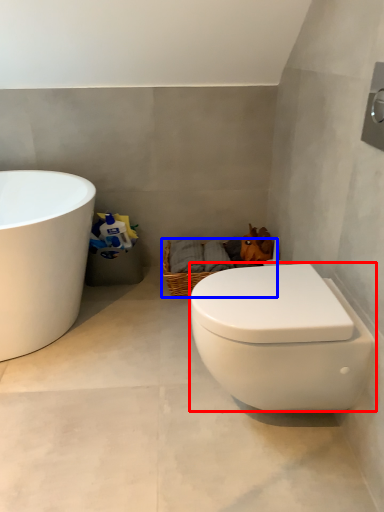
Question: Which object appears closest to the camera in this image, toilet (highlighted by a red box) or basket (highlighted by a blue box)?

Choices:
 (A) toilet
 (B) basket

Answer: (A)